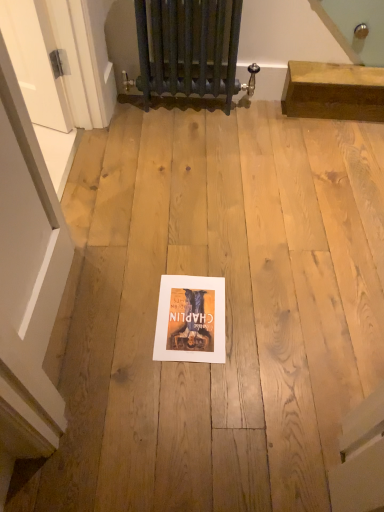
This screenshot has height=512, width=384. Find the location of `blank space to the left of matte paper postcard at center`. blank space to the left of matte paper postcard at center is located at coordinates (126, 310).